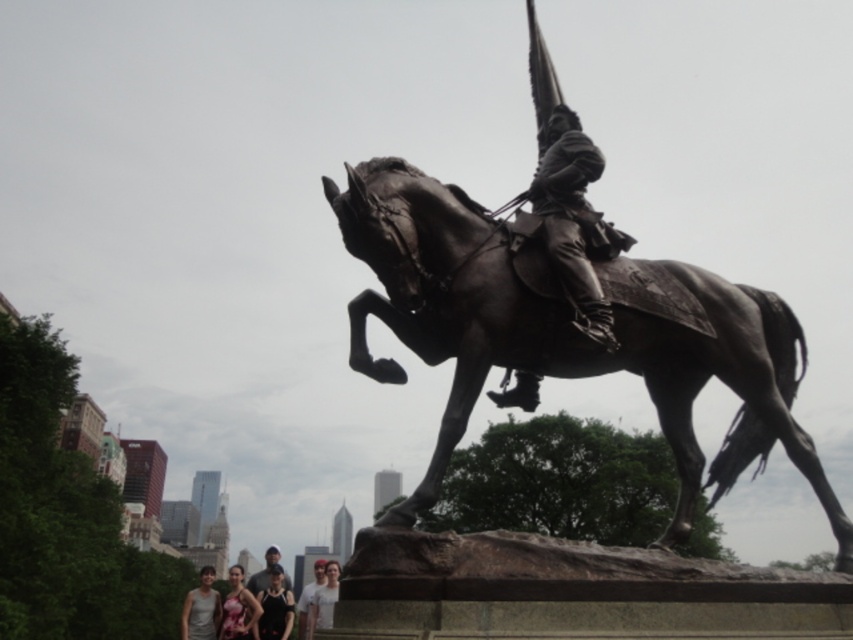
Which is in front, point (676, 371) or point (247, 595)?

Positioned in front is point (676, 371).

Who is taller, bronze statue at center or matte pink dress at lower center?

matte pink dress at lower center is taller.

Where is `bronze statue at center`? The image size is (853, 640). bronze statue at center is located at coordinates (561, 337).

You are a GUI agent. You are given a task and a screenshot of the screen. Output one action in this format:
    pyautogui.click(x=<x>, y=<y>)
    Task: Click on the bronze statue at center
    
    Given the screenshot: What is the action you would take?
    pyautogui.click(x=561, y=337)

Is point (187, 600) more distant than point (335, 579)?

Yes, it is behind point (335, 579).

Is point (207, 621) positioned before point (332, 588)?

No.

The image size is (853, 640). I want to click on matte gray tank top at lower left, so click(201, 609).

Which is more to the left, matte gray tank top at lower left or matte pink dress at lower center?

matte gray tank top at lower left

Can you confirm if matte gray tank top at lower left is taller than matte pink dress at lower center?

Indeed, matte gray tank top at lower left has a greater height compared to matte pink dress at lower center.

Does point (201, 573) come closer to viewer compared to point (236, 566)?

That is False.

I want to click on matte gray tank top at lower left, so click(201, 609).